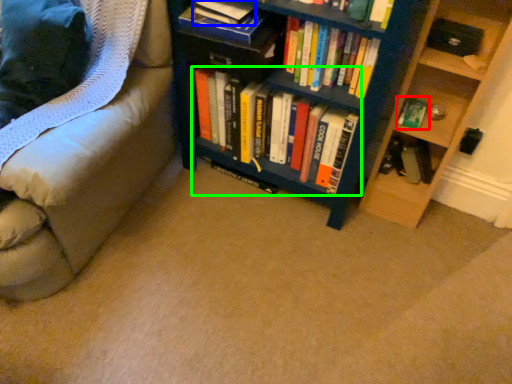
Question: Which object is positioned farthest from book (highlighted by a red box)? Select from book (highlighted by a blue box) and book (highlighted by a green box).

Choices:
 (A) book
 (B) book

Answer: (A)